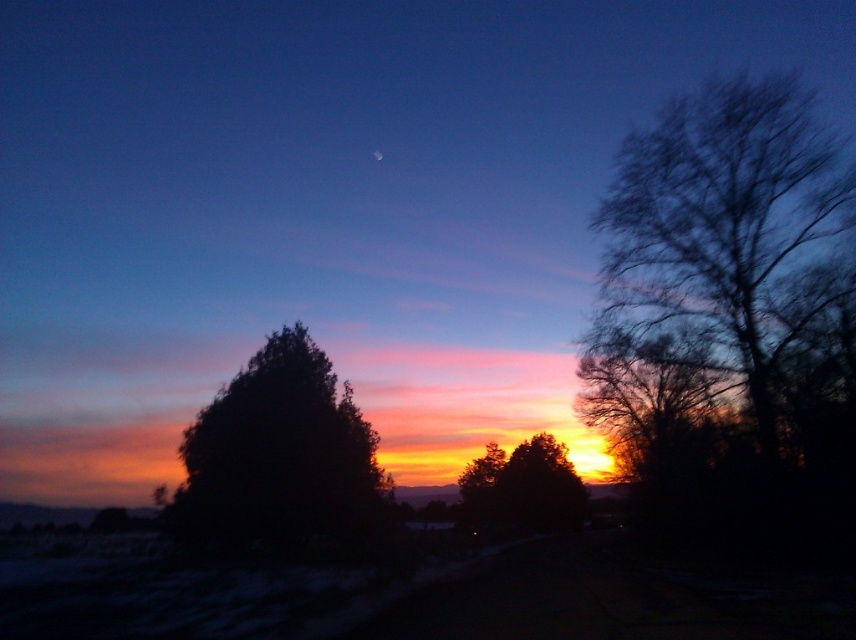
Question: Does bare branches at right lie in front of silhouette tree at center?

Choices:
 (A) yes
 (B) no

Answer: (A)

Question: Which object appears closest to the camera in this image?

Choices:
 (A) silhouette tree at center
 (B) bare branches at right
 (C) dark green leafy tree at center

Answer: (B)

Question: Can you confirm if bare branches at right is positioned below silhouette tree at center?

Choices:
 (A) no
 (B) yes

Answer: (A)

Question: Which object is the farthest from the dark green leafy tree at center?

Choices:
 (A) bare branches at right
 (B) silhouette tree at center

Answer: (B)

Question: Is bare branches at right smaller than silhouette tree at center?

Choices:
 (A) no
 (B) yes

Answer: (A)

Question: Which of the following is the farthest from the observer?

Choices:
 (A) (669, 321)
 (B) (560, 444)
 (C) (336, 536)

Answer: (B)